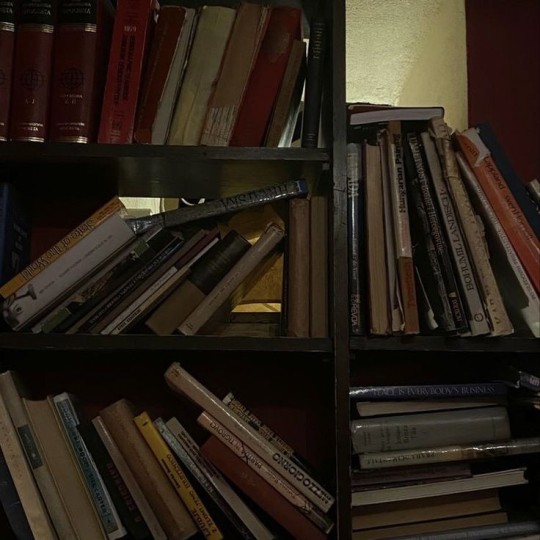
The width and height of the screenshot is (540, 540). Find the location of `very broken book cover`. very broken book cover is located at coordinates click(x=175, y=70).